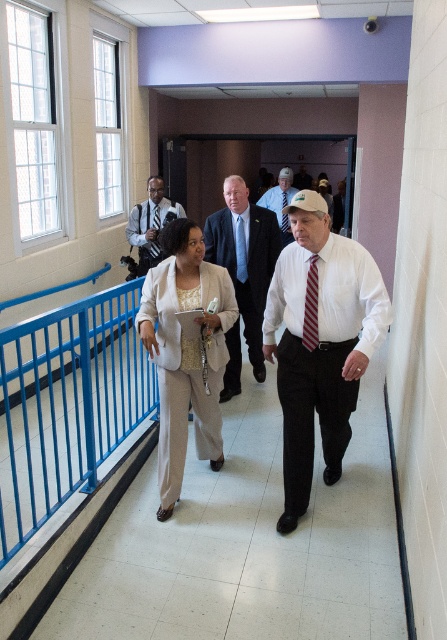
Who is higher up, striped fabric tie at center or black silk tie at center?

black silk tie at center is higher up.

Is striped fabric tie at center positioned in front of black silk tie at center?

Yes, it is in front of black silk tie at center.

Locate an element on the screen. This screenshot has height=640, width=447. striped fabric tie at center is located at coordinates (311, 307).

Is blue metallic handrail at left smaller than blue silk tie at center?

Incorrect, blue metallic handrail at left is not smaller in size than blue silk tie at center.

Is blue metallic handrail at left behind blue silk tie at center?

No, it is in front of blue silk tie at center.

Which is behind, point (93, 452) or point (237, 262)?

The point (237, 262) is behind.

The width and height of the screenshot is (447, 640). I want to click on blue metallic handrail at left, so click(x=67, y=403).

Between point (316, 337) and point (282, 205), which one is positioned behind?

Positioned behind is point (282, 205).

What do you see at coordinates (311, 307) in the screenshot?
I see `striped fabric tie at center` at bounding box center [311, 307].

Image resolution: width=447 pixels, height=640 pixels. Describe the element at coordinates (311, 307) in the screenshot. I see `striped fabric tie at center` at that location.

At what (x,y) coordinates should I click in order to perform the action: click on striped fabric tie at center. Please return your answer as a coordinate pair (x, y). Looking at the image, I should click on (311, 307).